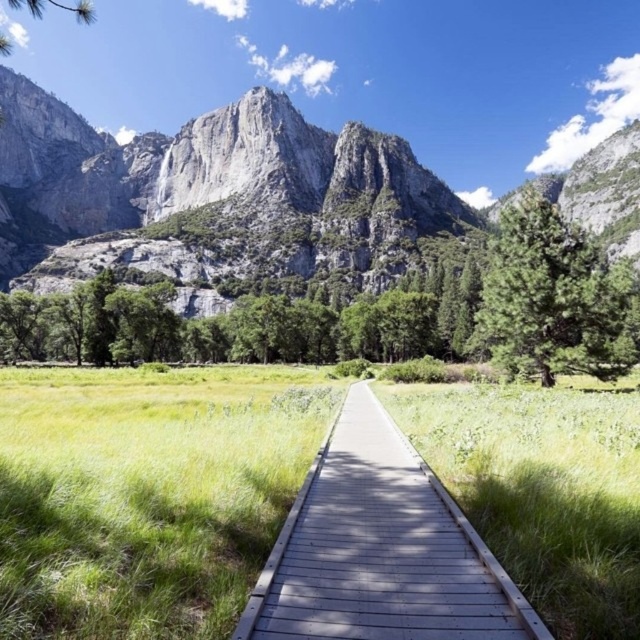
Question: Does gray rock mountain at center appear on the right side of wooden boardwalk at center?

Choices:
 (A) no
 (B) yes

Answer: (A)

Question: Which point is closer to the camera taking this photo?

Choices:
 (A) (387, 493)
 (B) (323, 205)

Answer: (A)

Question: Which object is closer to the camera taking this photo?

Choices:
 (A) wooden boardwalk at center
 (B) gray rock mountain at center

Answer: (A)

Question: In this image, where is gray rock mountain at center located relative to wooden boardwalk at center?

Choices:
 (A) below
 (B) above

Answer: (B)

Question: Is gray rock mountain at center further to the viewer compared to wooden boardwalk at center?

Choices:
 (A) no
 (B) yes

Answer: (B)